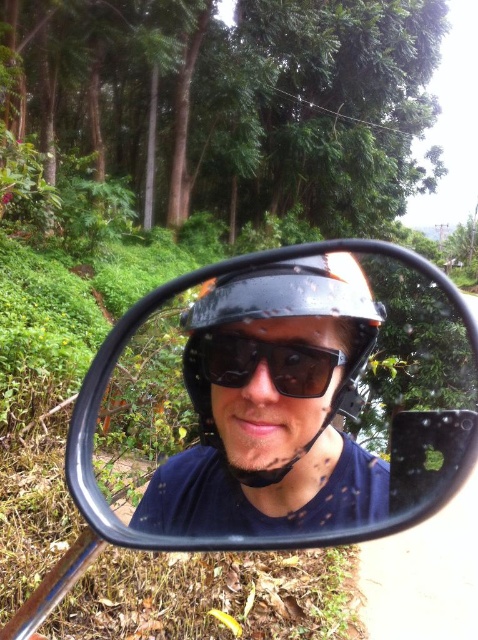
Does black matte mirror at center have a greater width compared to glossy black helmet at center?

Yes, black matte mirror at center is wider than glossy black helmet at center.

Between black matte mirror at center and glossy black helmet at center, which one is positioned lower?

Positioned lower is glossy black helmet at center.

Describe the element at coordinates (281, 401) in the screenshot. I see `black matte mirror at center` at that location.

At what (x,y) coordinates should I click in order to perform the action: click on black matte mirror at center. Please return your answer as a coordinate pair (x, y). This screenshot has width=478, height=640. Looking at the image, I should click on click(281, 401).

Does point (467, 467) lie in front of point (195, 353)?

Yes, it is in front of point (195, 353).

Measure the distance between black matte mirror at center and black matte sunglasses at center.

A distance of 6.84 meters exists between black matte mirror at center and black matte sunglasses at center.

This screenshot has width=478, height=640. What are the coordinates of `black matte mirror at center` in the screenshot? It's located at click(281, 401).

This screenshot has width=478, height=640. In order to click on black matte mirror at center in this screenshot , I will do `click(281, 401)`.

Does point (242, 288) lie behind point (325, 376)?

No, it is in front of (325, 376).

Which of these two, glossy black helmet at center or black matte sunglasses at center, stands shorter?

With less height is black matte sunglasses at center.

Image resolution: width=478 pixels, height=640 pixels. In order to click on glossy black helmet at center in this screenshot , I will do `click(279, 317)`.

Identify the location of glossy black helmet at center. The width and height of the screenshot is (478, 640). coord(279,317).